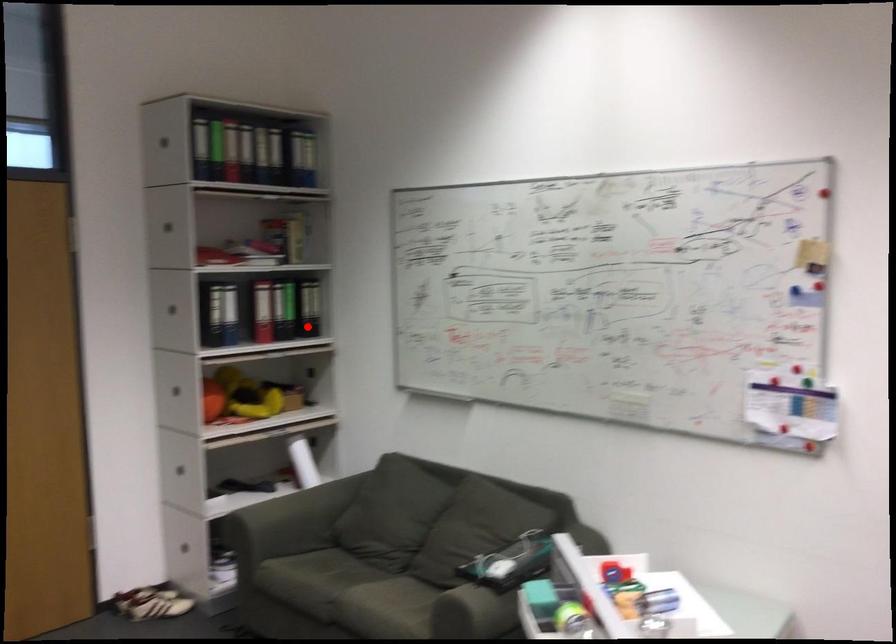
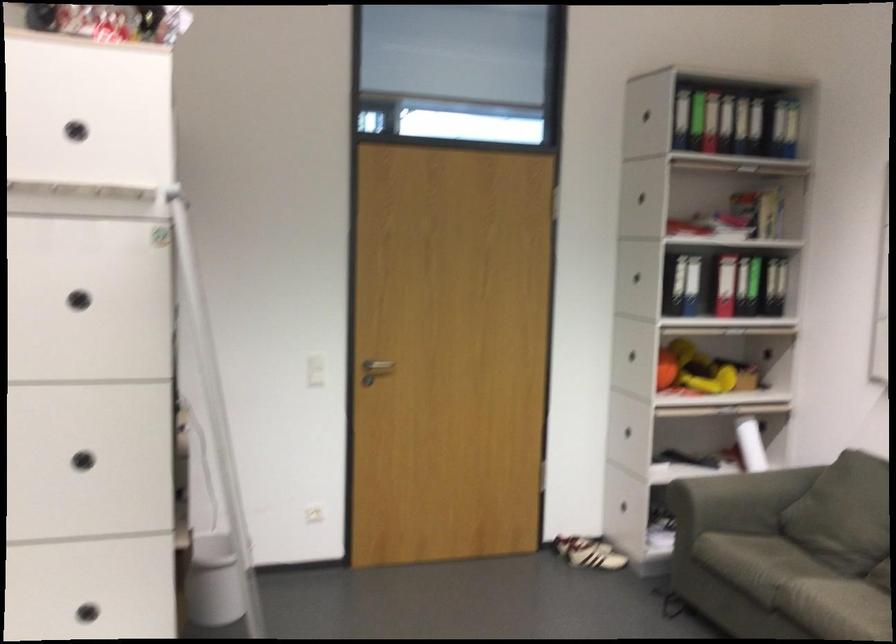
Question: I am providing you with two images of the same scene from different viewpoints. In image1, a red point is highlighted. Considering the same 3D point in image2, which of the following is correct?

Choices:
 (A) It is closer
 (B) It is farther

Answer: (A)